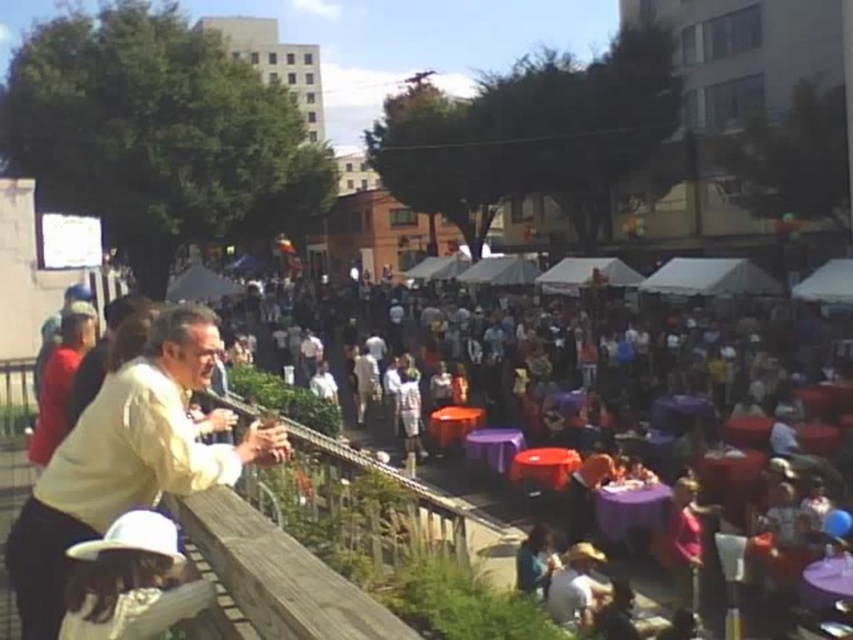
You are organizing a small picnic and need to decide between using the purple fabric tables at center or the white matte hat at lower left as a table. Based on their sizes, which one would be more suitable for placing a sandwich and a drink?

The purple fabric tables at center has a larger size compared to the white matte hat at lower left, so it would be more suitable for placing a sandwich and a drink.

You are standing at the event and want to take a photo that includes both the point at (729, 468) and the point at (62, 628). Which point should you focus on first to ensure both are in the frame?

You should focus on point (729, 468) first because it is closer to you than point (62, 628), ensuring both points are within the camera frame.

You are a photographer at the event and want to capture a photo of the purple fabric tables at center without the white matte hat at lower left blocking the view. Based on their positions, is this possible?

The purple fabric tables at center is located below the white matte hat at lower left, so if you position yourself lower or adjust the angle to avoid the hat, you can capture the tables without obstruction.